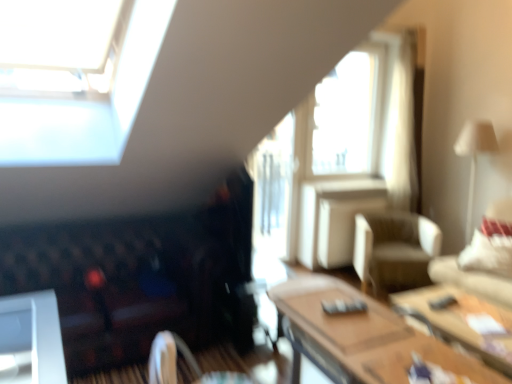
Question: In terms of width, does beige fabric swivel chair at center, the 1th swivel chair in the right-to-left sequence, look wider or thinner when compared to white fabric pillow at right?

Choices:
 (A) thin
 (B) wide

Answer: (B)

Question: Relative to white fabric pillow at right, is beige fabric swivel chair at center, the 1th swivel chair in the right-to-left sequence, in front or behind?

Choices:
 (A) front
 (B) behind

Answer: (B)

Question: Which of these objects is positioned closest to the velvet dark brown swivel chair at lower center, which appears as the 2th swivel chair when viewed from the right?

Choices:
 (A) white fabric lampshade at upper right
 (B) velvet dark brown futon at lower left
 (C) wooden table at lower right, marked as the 2th table in a front-to-back arrangement
 (D) white fabric pillow at right
 (E) beige fabric swivel chair at center, which is counted as the 1th swivel chair, starting from the back

Answer: (B)

Question: Which is farther from the white fabric lampshade at upper right?

Choices:
 (A) beige fabric swivel chair at center, positioned as the second swivel chair in front-to-back order
 (B) beige fabric couch at right
 (C) wooden table at lower right, which is the first table from back to front
 (D) wooden table at center, the 2th table positioned from the back
 (E) velvet dark brown swivel chair at lower center, which appears as the 2th swivel chair when viewed from the right

Answer: (E)